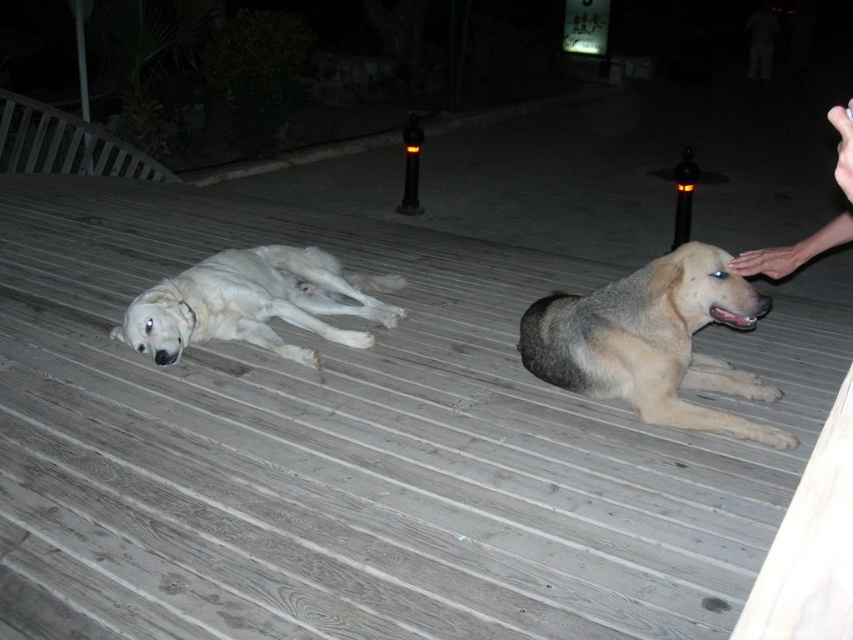
Question: Is light brown fur dog at center further to the viewer compared to smooth skin hand at upper right?

Choices:
 (A) yes
 (B) no

Answer: (A)

Question: Is white fur dog at left wider than smooth skin hand at upper right?

Choices:
 (A) no
 (B) yes

Answer: (B)

Question: Which object is the closest to the white fur dog at left?

Choices:
 (A) smooth skin hand at upper right
 (B) gray wood deck at center

Answer: (B)

Question: Which point is farther from the camera taking this photo?

Choices:
 (A) pos(850,184)
 (B) pos(625,337)
 (C) pos(294,257)
 (D) pos(273,637)

Answer: (C)

Question: Is light brown fur dog at center thinner than smooth skin hand at upper right?

Choices:
 (A) yes
 (B) no

Answer: (B)

Question: Which point appears farthest from the camera in this image?

Choices:
 (A) (660, 364)
 (B) (256, 289)
 (C) (837, 122)

Answer: (B)